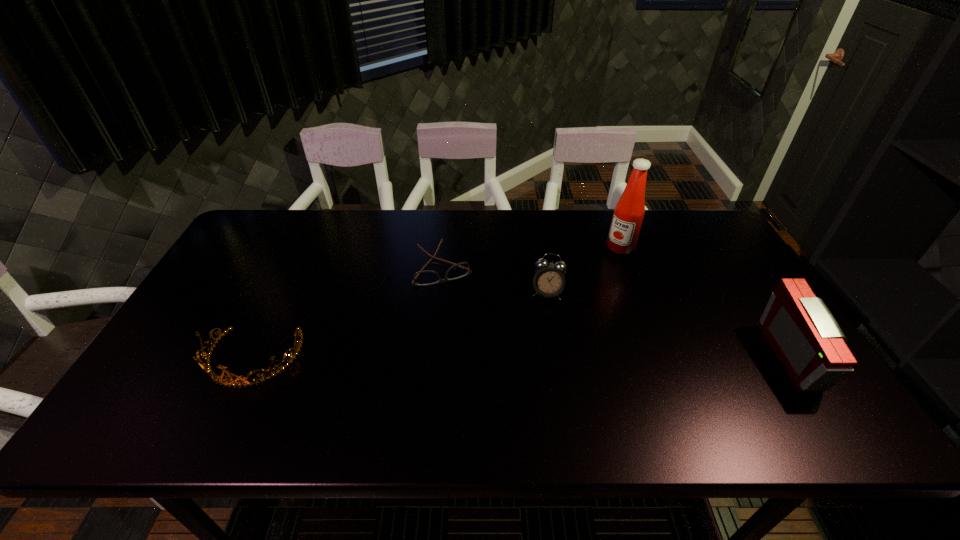
At what (x,y) coordinates should I click in order to perform the action: click on vacant area that lies between the rightmost object and the third object from right to left. Please return your answer as a coordinate pair (x, y). This screenshot has width=960, height=540. Looking at the image, I should click on (671, 325).

At what (x,y) coordinates should I click in order to perform the action: click on free space between the condiment and the shortest object. Please return your answer as a coordinate pair (x, y). The width and height of the screenshot is (960, 540). Looking at the image, I should click on (532, 258).

The width and height of the screenshot is (960, 540). Find the location of `the third closest object relative to the spectacles`. the third closest object relative to the spectacles is located at coordinates (629, 211).

You are a GUI agent. You are given a task and a screenshot of the screen. Output one action in this format:
    pyautogui.click(x=<x>, y=<y>)
    Task: Click on the object that stands as the third closest to the fourth object from right to left
    
    Given the screenshot: What is the action you would take?
    pyautogui.click(x=629, y=211)

Where is `vacant region that satisfies the following two spatial constraints: 1. on the front side of the third shortest object; 2. on the front-facing side of the camera`? The height and width of the screenshot is (540, 960). vacant region that satisfies the following two spatial constraints: 1. on the front side of the third shortest object; 2. on the front-facing side of the camera is located at coordinates (558, 357).

Where is `vacant space that satisfies the following two spatial constraints: 1. on the back side of the alarm clock; 2. on the left side of the condiment`? The image size is (960, 540). vacant space that satisfies the following two spatial constraints: 1. on the back side of the alarm clock; 2. on the left side of the condiment is located at coordinates tap(540, 247).

Identify the location of free region that satisfies the following two spatial constraints: 1. on the back side of the fourth object from left to right; 2. on the left side of the spectacles. (445, 247).